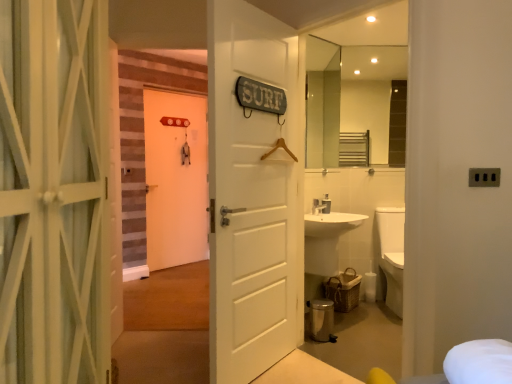
Question: Considering the relative positions of glossy glass mirror at upper center, acting as the 1th mirror starting from the right, and white matte door at center, which is counted as the 1th door, starting from the back, in the image provided, is glossy glass mirror at upper center, acting as the 1th mirror starting from the right, to the left or to the right of white matte door at center, which is counted as the 1th door, starting from the back,?

Choices:
 (A) left
 (B) right

Answer: (B)

Question: Considering the positions of glossy glass mirror at upper center, which is the 2th mirror in left-to-right order, and white matte door at center, which ranks as the 3th door in front-to-back order, in the image, is glossy glass mirror at upper center, which is the 2th mirror in left-to-right order, wider or thinner than white matte door at center, which ranks as the 3th door in front-to-back order,?

Choices:
 (A) thin
 (B) wide

Answer: (A)

Question: Which is nearer to the white painted wood door at left, marked as the 3th door in a back-to-front arrangement?

Choices:
 (A) glossy glass mirror at upper center, which is the 2th mirror in left-to-right order
 (B) clear glass mirror at upper right, which appears as the 2th mirror when viewed from the right
 (C) white matte door at center, the 1th door positioned from the right
 (D) white matte door at center, which is counted as the 1th door, starting from the back

Answer: (C)

Question: Which is farther from the white painted wood door at left, which is the first door from front to back?

Choices:
 (A) clear glass mirror at upper right, which ranks as the 1th mirror in left-to-right order
 (B) white matte door at center, placed as the 3th door when sorted from right to left
 (C) white matte door at center, which is the 2th door from back to front
 (D) glossy glass mirror at upper center, acting as the 1th mirror starting from the right

Answer: (B)